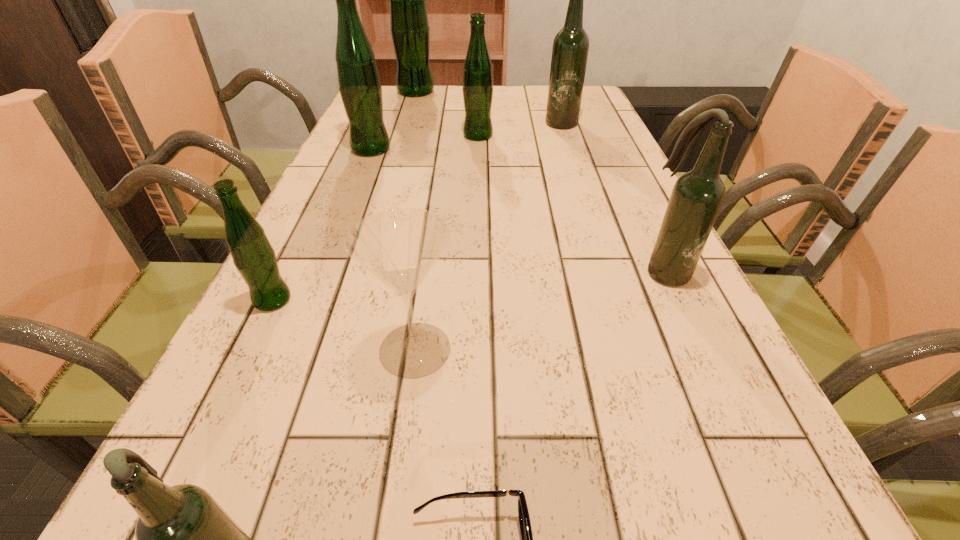
I want to click on flute glass, so [x=399, y=246].

This screenshot has height=540, width=960. I want to click on vacant space located 0.310m on the front of the tallest object, so click(401, 140).

At what (x,y) coordinates should I click in order to perform the action: click on vacant space situated 0.050m on the right of the second dark beer bottle from right to left. Please return your answer as a coordinate pair (x, y). Looking at the image, I should click on (593, 121).

Find the location of a particular element. vacant space located on the back of the third smallest green beer bottle is located at coordinates (390, 103).

Locate an element on the screen. The image size is (960, 540). vacant point located 0.070m on the left of the third beer bottle from right to left is located at coordinates (438, 136).

You are a GUI agent. You are given a task and a screenshot of the screen. Output one action in this format:
    pyautogui.click(x=<x>, y=<y>)
    Task: Click on the free space located 0.080m on the back of the rightmost beer bottle
    The width and height of the screenshot is (960, 540).
    Given the screenshot: What is the action you would take?
    (646, 231)

The image size is (960, 540). What are the coordinates of `free region located on the front of the nearest green beer bottle` in the screenshot? It's located at [x=215, y=417].

Locate an element on the screen. vacant region located on the right of the third nearest object is located at coordinates (529, 349).

Find the location of a particular element. object that is at the far left corner is located at coordinates (409, 26).

Identify the location of object located in the far right corner section of the desktop. (570, 49).